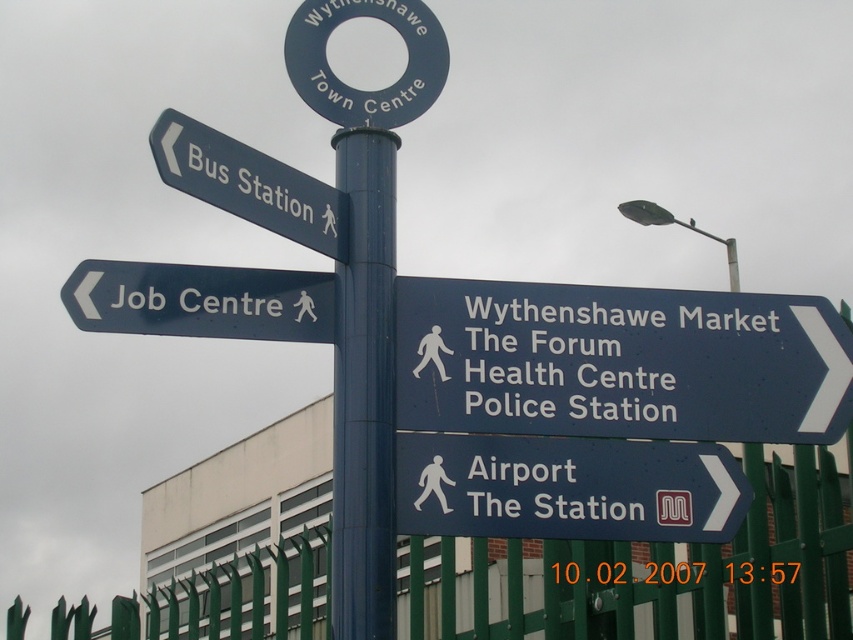
Question: Which point is farther to the camera?

Choices:
 (A) blue metallic pole at center
 (B) matte black sign at left
 (C) green metal fence at lower right
 (D) blue plastic sign at lower center

Answer: (C)

Question: Does blue plastic sign at lower center have a smaller size compared to blue metallic pole at center?

Choices:
 (A) yes
 (B) no

Answer: (A)

Question: Estimate the real-world distances between objects in this image. Which object is farther from the blue metallic sign at center right?

Choices:
 (A) matte black sign at left
 (B) blue plastic sign at lower center
 (C) matte blue signpost at upper left
 (D) blue metallic pole at center

Answer: (C)

Question: Does green metal fence at lower right have a greater width compared to matte blue signpost at upper left?

Choices:
 (A) yes
 (B) no

Answer: (A)

Question: Which of the following is the closest to the observer?

Choices:
 (A) matte blue signpost at upper left
 (B) blue metallic sign at center right
 (C) blue metallic pole at center
 (D) blue plastic sign at lower center

Answer: (C)

Question: Observing the image, what is the correct spatial positioning of blue metallic sign at center right in reference to matte black sign at left?

Choices:
 (A) left
 (B) right

Answer: (B)